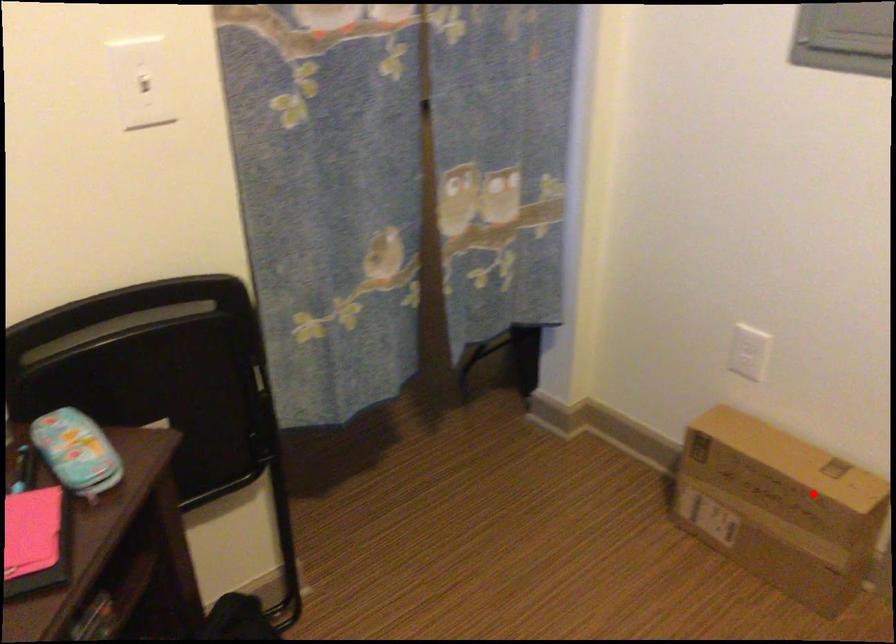
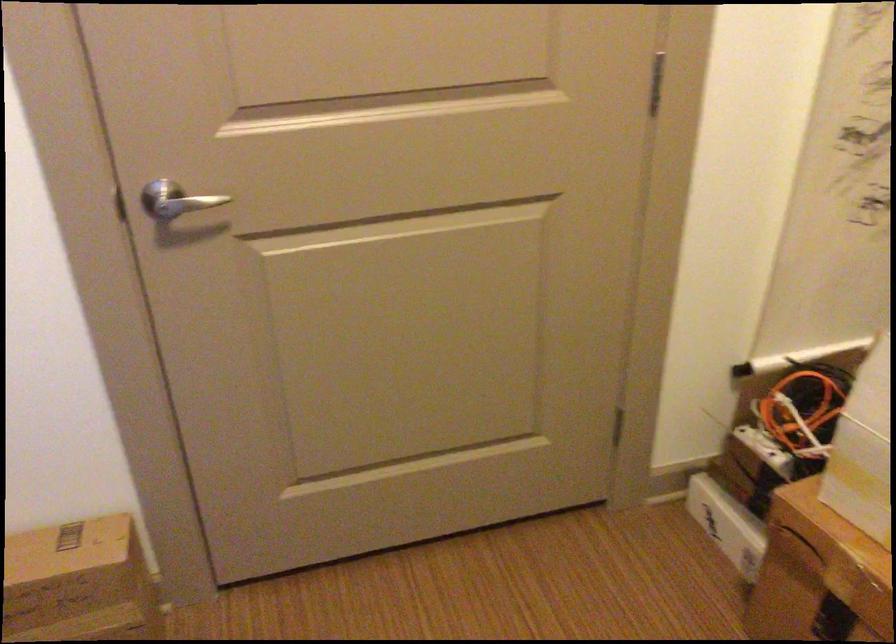
Question: A red point is marked in image1. In image2, is the corresponding 3D point closer to the camera or farther? Reply with the corresponding letter.

Choices:
 (A) The corresponding 3D point is closer.
 (B) The corresponding 3D point is farther.

Answer: (A)